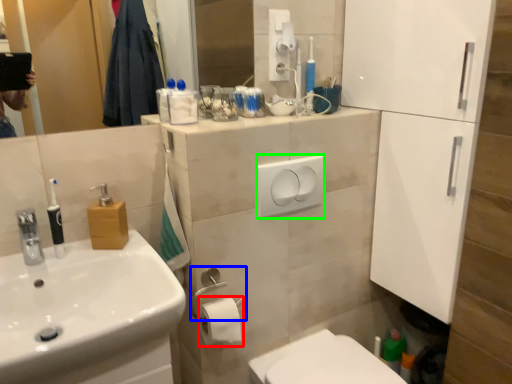
Question: Which is nearer to the toilet paper (highlighted by a red box)? towel bar (highlighted by a blue box) or light switch (highlighted by a green box).

Choices:
 (A) towel bar
 (B) light switch

Answer: (A)